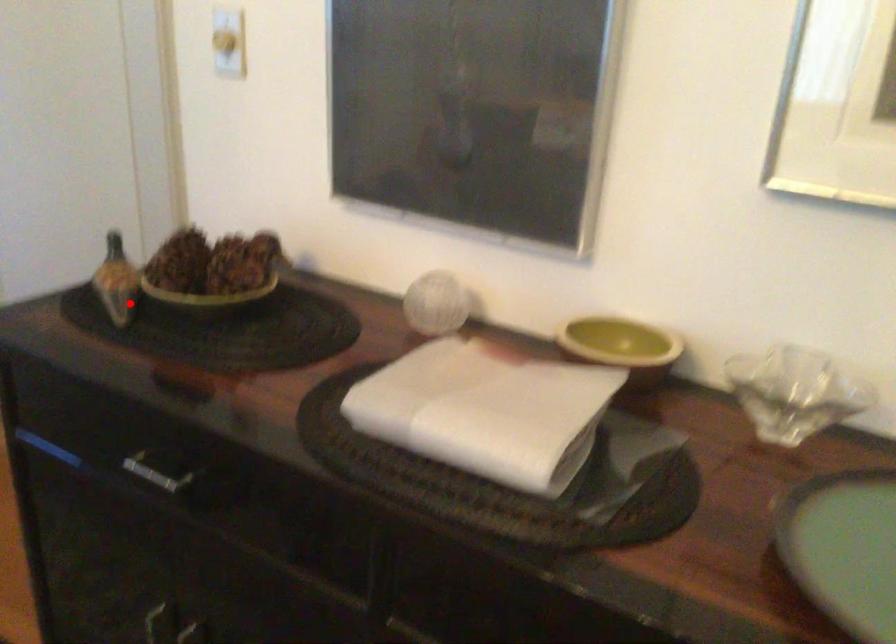
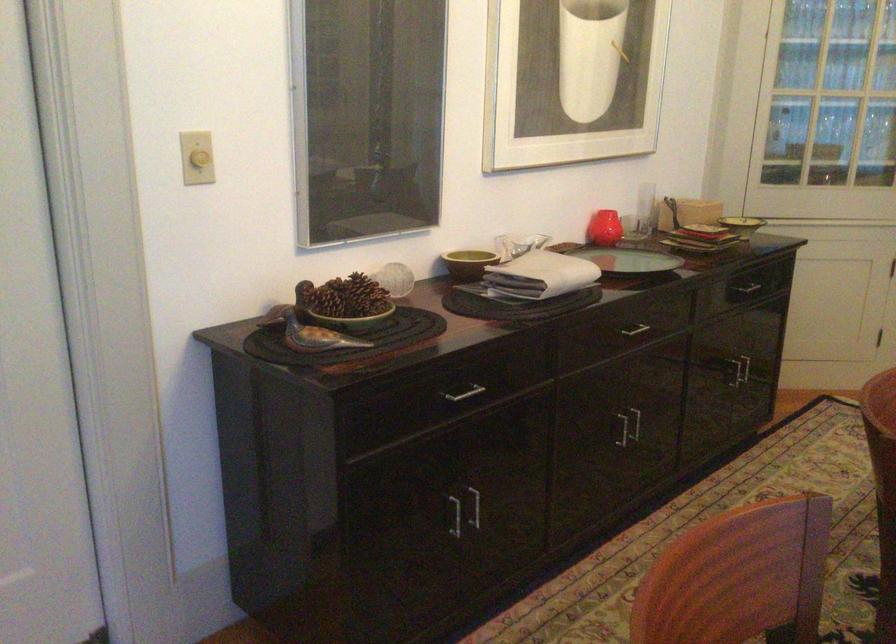
Question: I am providing you with two images of the same scene from different viewpoints. Given a red point in image1, look at the same physical point in image2. Is it:

Choices:
 (A) Closer to the viewpoint
 (B) Farther from the viewpoint

Answer: (B)